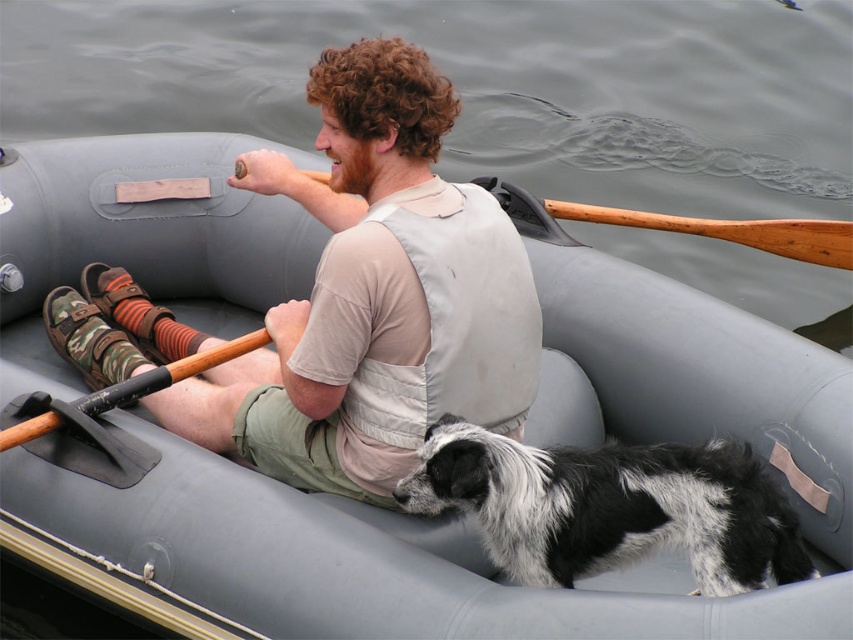
Does camouflage-patterned sandal at lower left appear on the right side of wooden paddle at upper center?

No, camouflage-patterned sandal at lower left is not to the right of wooden paddle at upper center.

Who is more forward, [430,138] or [743,225]?

Positioned in front is point [430,138].

Describe the element at coordinates (375, 296) in the screenshot. I see `camouflage-patterned sandal at lower left` at that location.

The height and width of the screenshot is (640, 853). I want to click on camouflage-patterned sandal at lower left, so click(375, 296).

Who is more forward, (265, 474) or (653, 540)?

Positioned in front is point (653, 540).

Is camouflage-patterned sandal at lower left thinner than black and white fur dog at center?

No, camouflage-patterned sandal at lower left is not thinner than black and white fur dog at center.

The height and width of the screenshot is (640, 853). Identify the location of camouflage-patterned sandal at lower left. (375, 296).

Does black and white fur dog at center have a lesser width compared to wooden paddle at upper center?

Yes, black and white fur dog at center is thinner than wooden paddle at upper center.

Is black and white fur dog at center to the left of wooden paddle at upper center from the viewer's perspective?

Yes, black and white fur dog at center is to the left of wooden paddle at upper center.

Locate an element on the screen. The width and height of the screenshot is (853, 640). black and white fur dog at center is located at coordinates [610, 506].